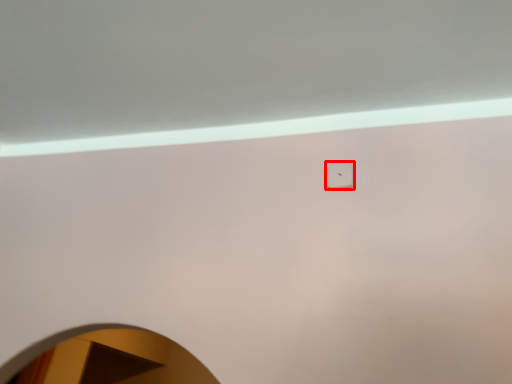
Question: Where is light switch (annotated by the red box) located in relation to mirror in the image?

Choices:
 (A) left
 (B) right

Answer: (B)